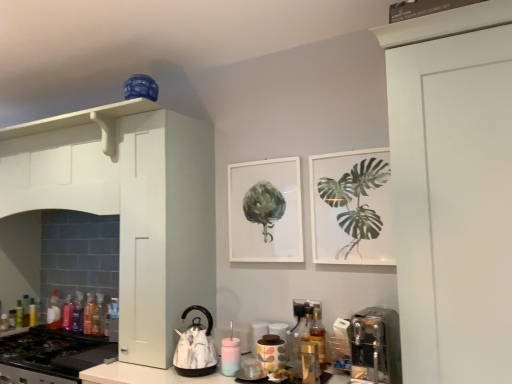
Question: Is satin silver coffee machine at lower right bigger or smaller than white matte cabinet at left?

Choices:
 (A) big
 (B) small

Answer: (B)

Question: From a real-world perspective, is satin silver coffee machine at lower right positioned above or below white matte cabinet at left?

Choices:
 (A) above
 (B) below

Answer: (B)

Question: Considering the real-world distances, which object is closest to the white glossy kettle at lower center, the third appliance from the right?

Choices:
 (A) translucent plastic bottle at lower left, which ranks as the 2th bottle in back-to-front order
 (B) translucent plastic bottle at lower left, which is the 5th bottle from back to front
 (C) green leafy plant at upper right
 (D) matte ceramic mug at center, arranged as the 2th appliance when viewed from the left
 (E) translucent glass bottle at lower center, which is the first bottle from right to left

Answer: (D)

Question: Estimate the real-world distances between objects in this image. Which object is farther from the translucent plastic bottle at lower left, the eighth bottle from the right?

Choices:
 (A) white matte cabinet at left
 (B) translucent plastic bottles at left, the fourth bottle when ordered from front to back
 (C) matte ceramic mug at center, the second appliance positioned from the right
 (D) matte white frame at center
 (E) matte ceramic jar at lower center, placed as the third appliance when sorted from left to right

Answer: (E)